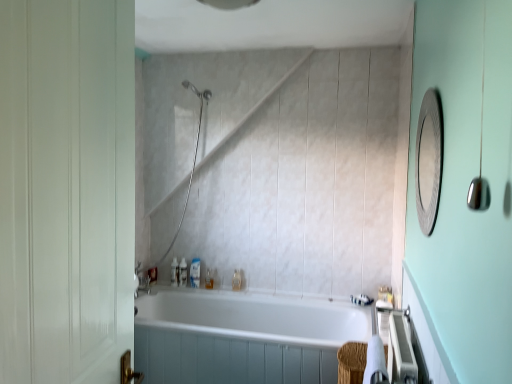
Question: From a real-world perspective, is translucent plastic soap at upper left, acting as the second toiletry starting from the left, located higher than translucent plastic soap dispenser at center, the fourth toiletry positioned from the left?

Choices:
 (A) yes
 (B) no

Answer: (B)

Question: From the image's perspective, is translucent plastic soap at upper left, which is the sixth toiletry from right to left, above translucent plastic soap dispenser at center, the fourth toiletry positioned from the left?

Choices:
 (A) yes
 (B) no

Answer: (A)

Question: Is translucent plastic soap at upper left, acting as the second toiletry starting from the left, in contact with translucent plastic soap dispenser at center, the fourth toiletry positioned from the left?

Choices:
 (A) no
 (B) yes

Answer: (A)

Question: Can translucent plastic soap dispenser at center, the 4th toiletry positioned from the right, be found inside translucent plastic soap at upper left, which is the sixth toiletry from right to left?

Choices:
 (A) yes
 (B) no

Answer: (B)

Question: Could you tell me if translucent plastic soap at upper left, acting as the second toiletry starting from the left, is facing translucent plastic soap dispenser at center, the 4th toiletry positioned from the right?

Choices:
 (A) yes
 (B) no

Answer: (B)

Question: Considering the relative sizes of translucent plastic soap at upper left, which is the sixth toiletry from right to left, and translucent plastic soap dispenser at center, the 4th toiletry positioned from the right, in the image provided, is translucent plastic soap at upper left, which is the sixth toiletry from right to left, taller than translucent plastic soap dispenser at center, the 4th toiletry positioned from the right,?

Choices:
 (A) yes
 (B) no

Answer: (B)

Question: Is translucent plastic bottle at lower center, which is the sixth toiletry in left-to-right order, oriented towards white glossy bathtub at center?

Choices:
 (A) yes
 (B) no

Answer: (B)

Question: Considering the relative sizes of translucent plastic bottle at lower center, which is the sixth toiletry in left-to-right order, and white glossy bathtub at center in the image provided, is translucent plastic bottle at lower center, which is the sixth toiletry in left-to-right order, bigger than white glossy bathtub at center?

Choices:
 (A) yes
 (B) no

Answer: (B)

Question: Can you confirm if translucent plastic bottle at lower center, arranged as the 2th toiletry when viewed from the right, is positioned to the right of white glossy bathtub at center?

Choices:
 (A) no
 (B) yes

Answer: (A)

Question: Does translucent plastic bottle at lower center, which is the sixth toiletry in left-to-right order, come behind white glossy bathtub at center?

Choices:
 (A) yes
 (B) no

Answer: (A)

Question: Are translucent plastic bottle at lower center, which is the sixth toiletry in left-to-right order, and white glossy bathtub at center located far from each other?

Choices:
 (A) no
 (B) yes

Answer: (A)

Question: From the image's perspective, is translucent plastic bottle at lower center, which is the sixth toiletry in left-to-right order, on white glossy bathtub at center?

Choices:
 (A) yes
 (B) no

Answer: (A)

Question: Is translucent plastic soap dispenser at center, the fourth toiletry positioned from the left, located outside metallic textured mirror at upper right?

Choices:
 (A) no
 (B) yes

Answer: (B)